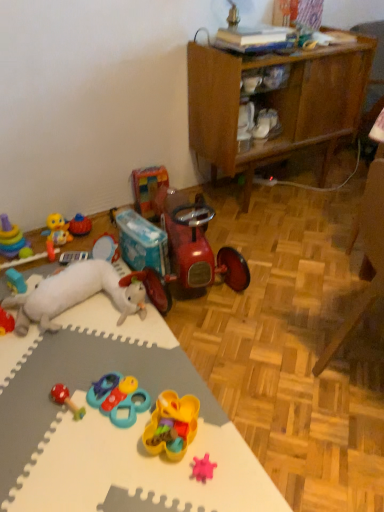
Find the location of a particular element. free space to the back side of teal plastic toy at center, the eighth toy viewed from the left is located at coordinates (132, 354).